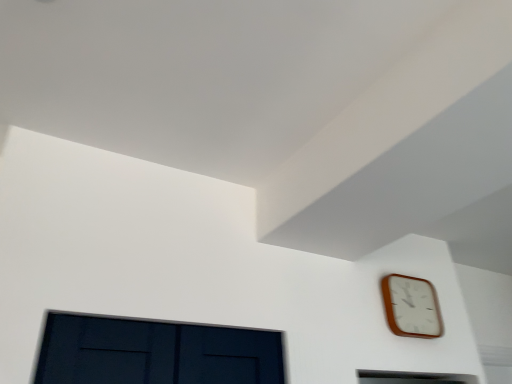
The height and width of the screenshot is (384, 512). Describe the element at coordinates (411, 306) in the screenshot. I see `wooden wall clock at upper right` at that location.

Where is `wooden wall clock at upper right`? This screenshot has height=384, width=512. wooden wall clock at upper right is located at coordinates (411, 306).

Locate an element on the screen. wooden wall clock at upper right is located at coordinates pos(411,306).